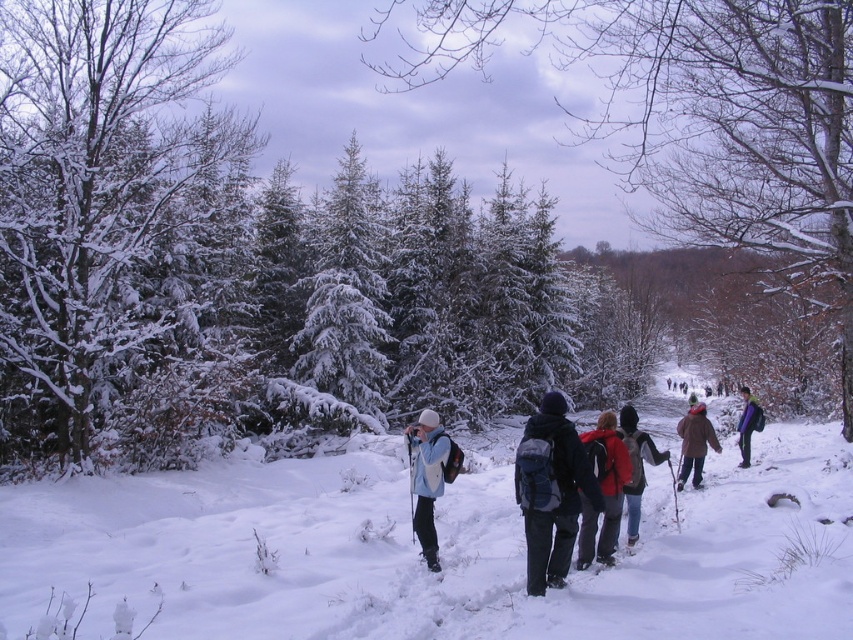
Does point (766, 72) come in front of point (645, 440)?

No.

Can you confirm if snow-covered evergreen tree at center is positioned to the left of denim jacket at center?

Incorrect, snow-covered evergreen tree at center is not on the left side of denim jacket at center.

Locate an element on the screen. Image resolution: width=853 pixels, height=640 pixels. snow-covered evergreen tree at center is located at coordinates (703, 120).

Is white snow-covered tree at left bigger than denim jacket at center?

Yes.

Between point (115, 342) and point (660, 452), which one is positioned behind?

The point (115, 342) is more distant.

Where is `white snow-covered tree at left`? This screenshot has width=853, height=640. white snow-covered tree at left is located at coordinates (112, 228).

The image size is (853, 640). In order to click on white snow-covered tree at left in this screenshot , I will do click(x=112, y=228).

Who is more forward, (32, 611) or (630, 445)?

Positioned in front is point (32, 611).

Does white fluffy snow at center have a lesser height compared to denim jacket at center?

No.

Between point (41, 598) and point (634, 440), which one is positioned behind?

The point (634, 440) is more distant.

Find the location of a particular element. The width and height of the screenshot is (853, 640). white fluffy snow at center is located at coordinates (439, 550).